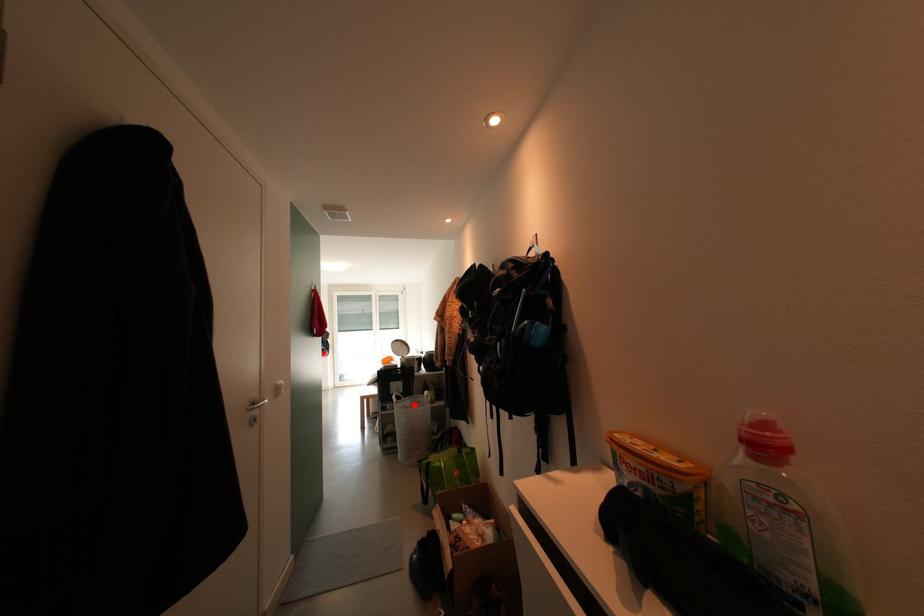
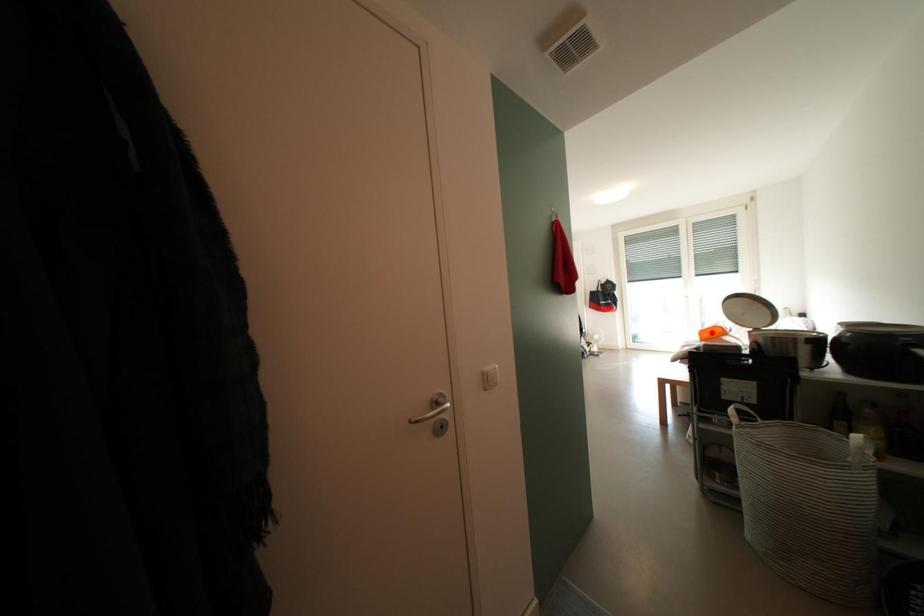
I am providing you with two images of the same scene from different viewpoints. A red point is marked on the first image and another point is marked on the second image. Is the red point in image1 aligned with the point shown in image2?

No